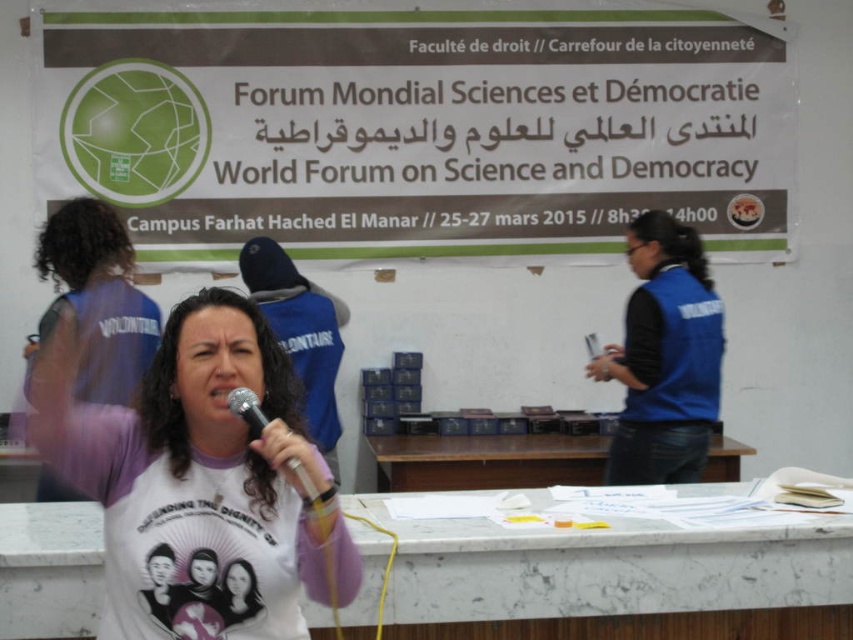
You are attending the World Forum on Science and Democracy and need to present a poster. The poster requires a surface taller than the blue fabric vest at center. Is the white paperboard at upper center suitable for your needs?

The white paperboard at upper center is taller than the blue fabric vest at center, so it is suitable for your poster presentation.

You are attending the World Forum on Science and Democracy and want to take a photo of the speaker. You notice two points in the room marked as point 1 at coordinates (340,220) and point 2 at coordinates (611,368). Which point is closer to the camera where you are standing?

Point 1 at coordinates (340,220) is closer to the camera than point 2 at coordinates (611,368) because it is further to the camera than the other point.

You are an event photographer at the World Forum on Science and Democracy. You want to take a closeup photo of the speaker, focusing on both the white cotton shirt at center and the metallic silver microphone at center. Can you fit both objects in the frame if your camera has a minimum focus distance of 6 inches?

The white cotton shirt at center and metallic silver microphone at center are 7.32 inches apart. Since the distance between them is greater than the camera minimum focus distance of 6 inches, the photographer cannot fit both objects in the frame.